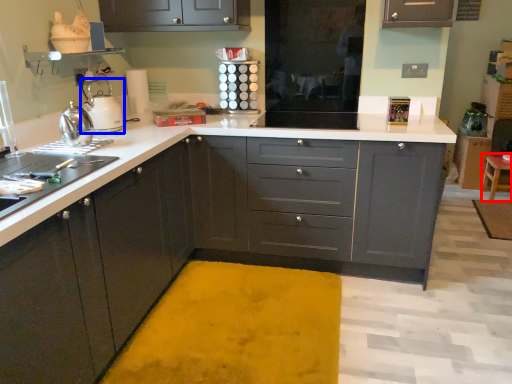
Question: Which of the following is the closest to the observer, stool (highlighted by a red box) or kitchen appliance (highlighted by a blue box)?

Choices:
 (A) stool
 (B) kitchen appliance

Answer: (B)